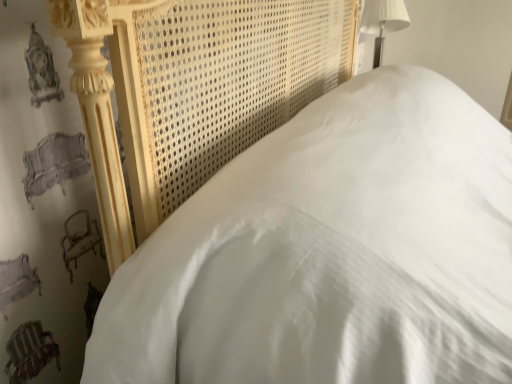
The image size is (512, 384). I want to click on white fabric lampshade at upper right, so click(x=383, y=22).

Describe the element at coordinates (383, 22) in the screenshot. I see `white fabric lampshade at upper right` at that location.

Looking at this image, in order to face white fabric lampshade at upper right, should I rotate leftwards or rightwards?

It's best to rotate right around 16.708 degrees.

The width and height of the screenshot is (512, 384). What are the coordinates of `white fabric lampshade at upper right` in the screenshot? It's located at (383, 22).